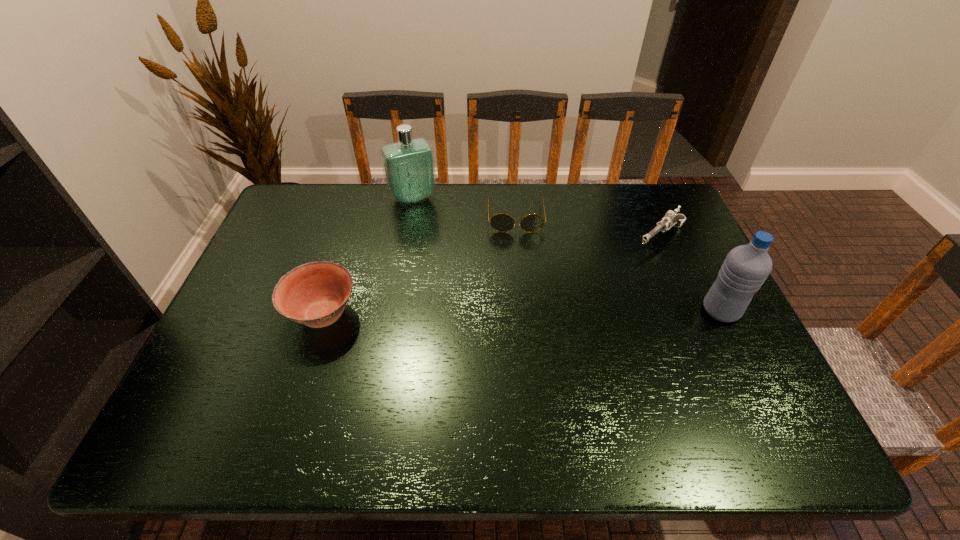
What are the coordinates of `vacant point that satisfies the following two spatial constraints: 1. on the front side of the gun; 2. on the right side of the water bottle` in the screenshot? It's located at (692, 311).

Where is `vacant space that satisfies the following two spatial constraints: 1. on the back side of the bowl; 2. on the left side of the gun`? The height and width of the screenshot is (540, 960). vacant space that satisfies the following two spatial constraints: 1. on the back side of the bowl; 2. on the left side of the gun is located at coordinates (348, 238).